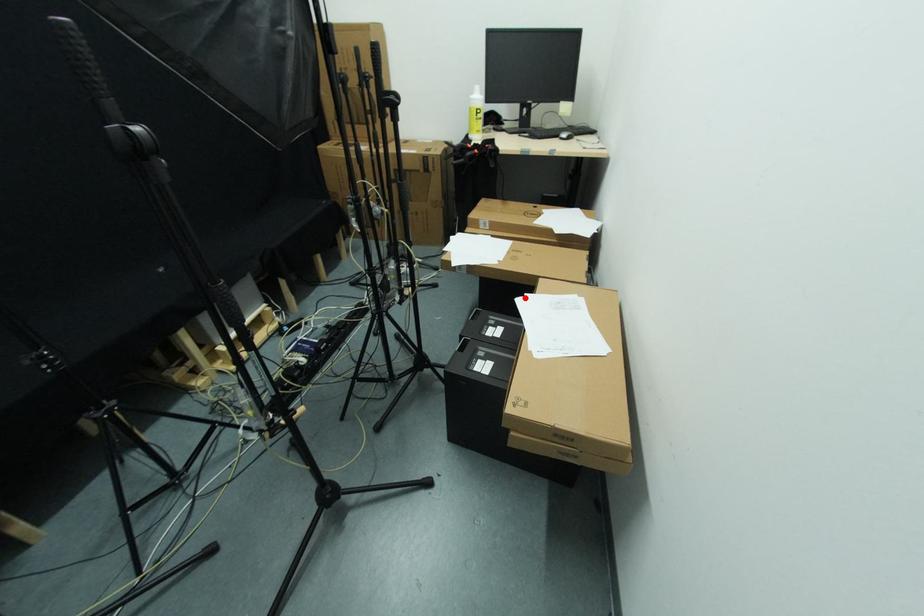
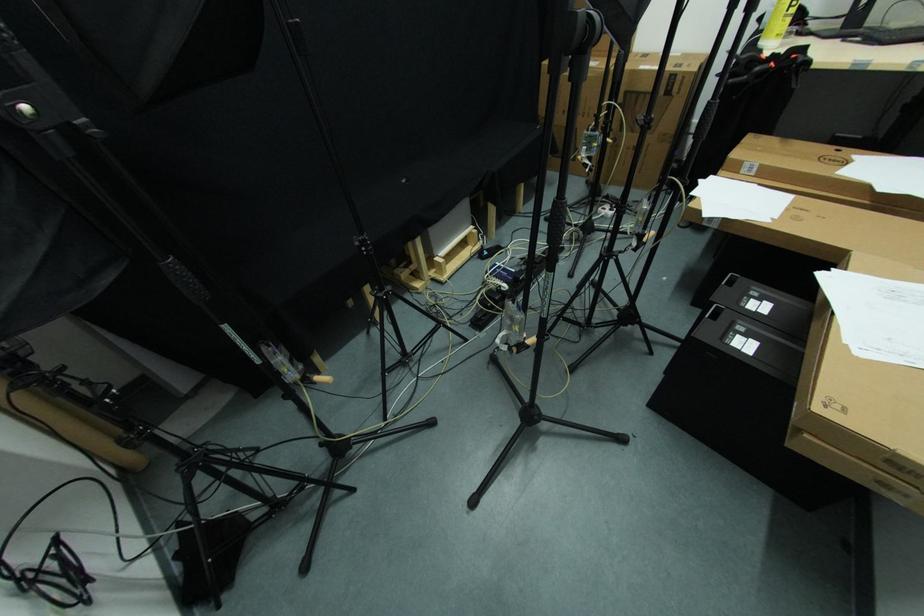
Find the pixel in the second image that matches the highlighted location in the first image.

(830, 273)